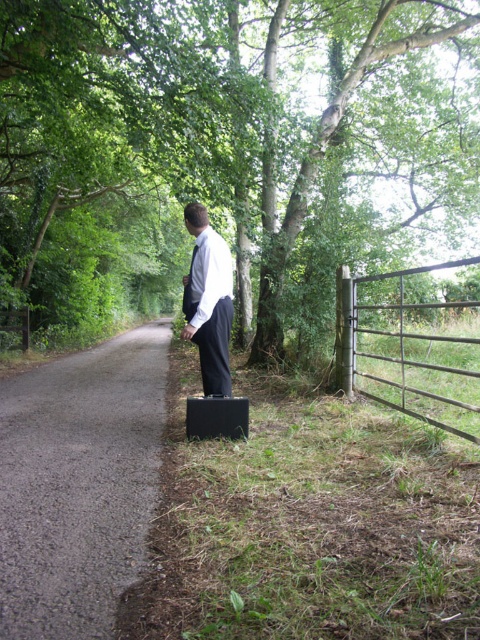
Question: Is green leafy tree at center smaller than black matte suitcase at lower center?

Choices:
 (A) yes
 (B) no

Answer: (B)

Question: From the image, what is the correct spatial relationship of gray asphalt road at center in relation to black matte suitcase at lower center?

Choices:
 (A) below
 (B) above

Answer: (A)

Question: Which is farther from the green leafy tree at center?

Choices:
 (A) white smooth shirt at center
 (B) gray asphalt road at center

Answer: (A)

Question: Which of the following is the closest to the observer?

Choices:
 (A) (229, 401)
 (B) (10, 548)
 (C) (193, 316)

Answer: (B)

Question: Is green leafy tree at center bigger than metallic gate at right?

Choices:
 (A) yes
 (B) no

Answer: (A)

Question: Which point appears closest to the camera in this image?

Choices:
 (A) (468, 326)
 (B) (232, 436)
 (C) (38, 464)
 (D) (435, 76)

Answer: (C)